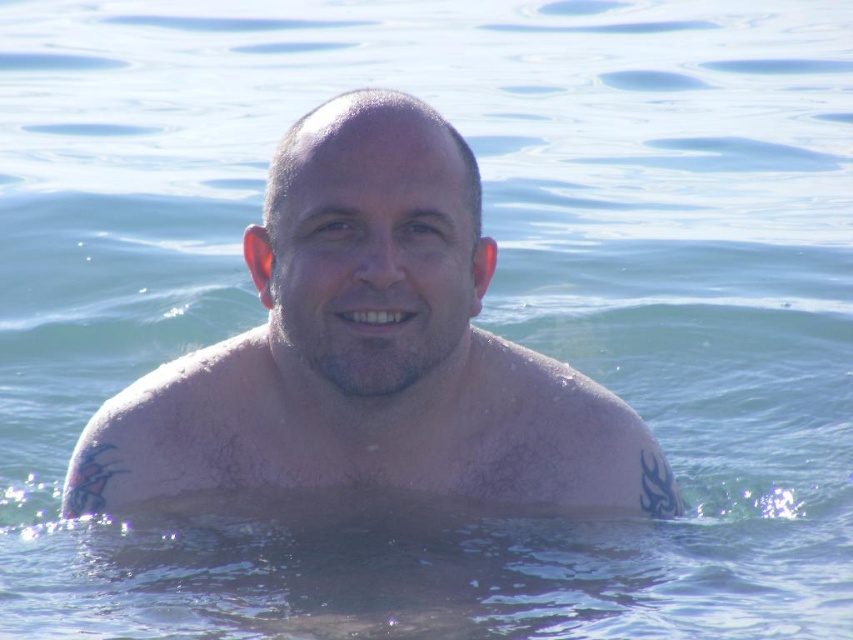
Which is above, pale skin at center or pale skin muscle at center?

pale skin at center is higher up.

Can you confirm if pale skin at center is wider than pale skin muscle at center?

Indeed, pale skin at center has a greater width compared to pale skin muscle at center.

Is point (285, 172) positioned behind point (486, 410)?

No.

At what (x,y) coordinates should I click in order to perform the action: click on pale skin at center. Please return your answer as a coordinate pair (x, y). Looking at the image, I should click on (369, 353).